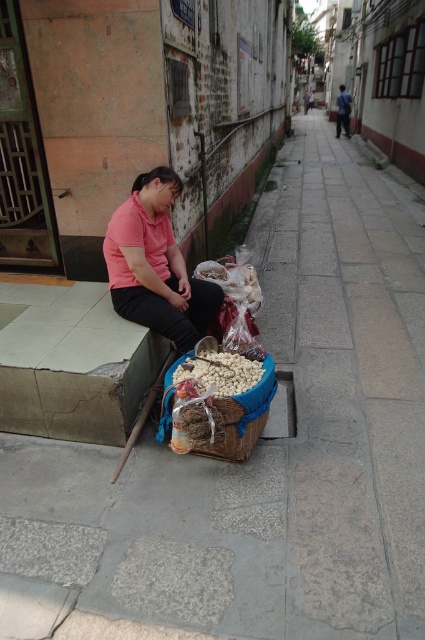
You are a delivery person who needs to place a package on the blue woven basket at center without disturbing the matte pink shirt at center. Can you do this?

The blue woven basket at center is closer to the viewer than the matte pink shirt at center, so yes, you can place the package on the blue woven basket at center without disturbing the matte pink shirt at center.

You are a delivery person who needs to place a package on the lowest available surface in the alley. You see the white matte nuts at center and the blue woven basket at center. Which surface should you choose?

The blue woven basket at center is the lower surface, so you should place the package there.

You are holding a camera and want to take a photo of the pink matte shirt at center. If you are standing 3 meters away from the shirt, will you be able to capture it in your photo without moving closer?

The pink matte shirt at center and camera are 3.17 meters apart from each other. Since you are standing 3 meters away, you are closer than the required distance. Therefore, you can capture the pink matte shirt at center in your photo without needing to move closer.